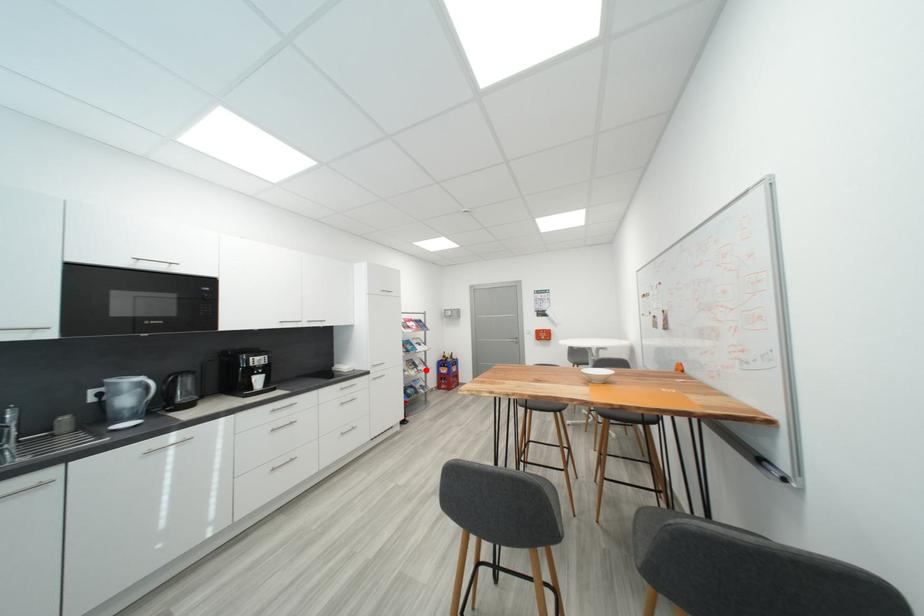
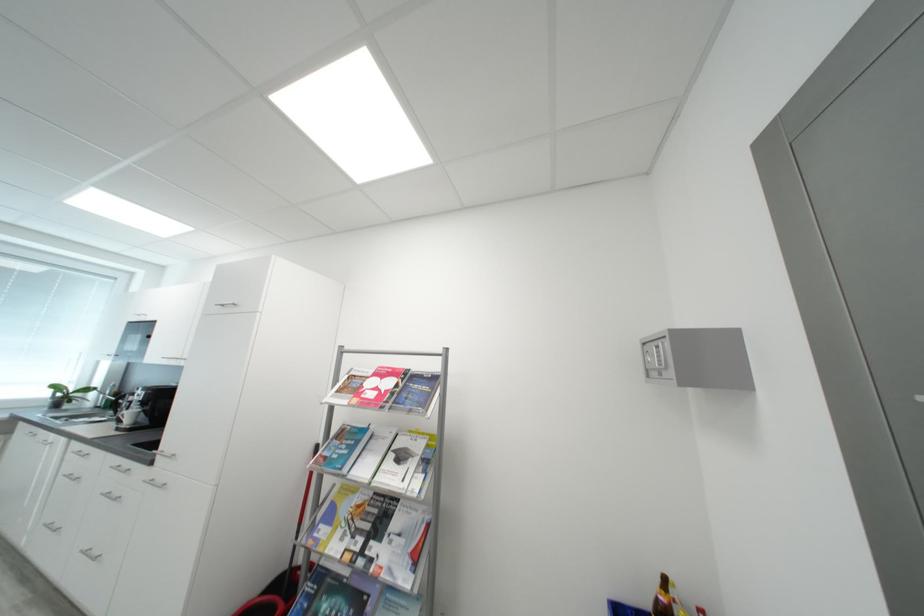
Question: I am providing you with two images of the same scene from different viewpoints. A red point is shown in image1. For the corresponding object point in image2, is it positioned nearer or farther from the camera?

Choices:
 (A) Nearer
 (B) Farther

Answer: (A)